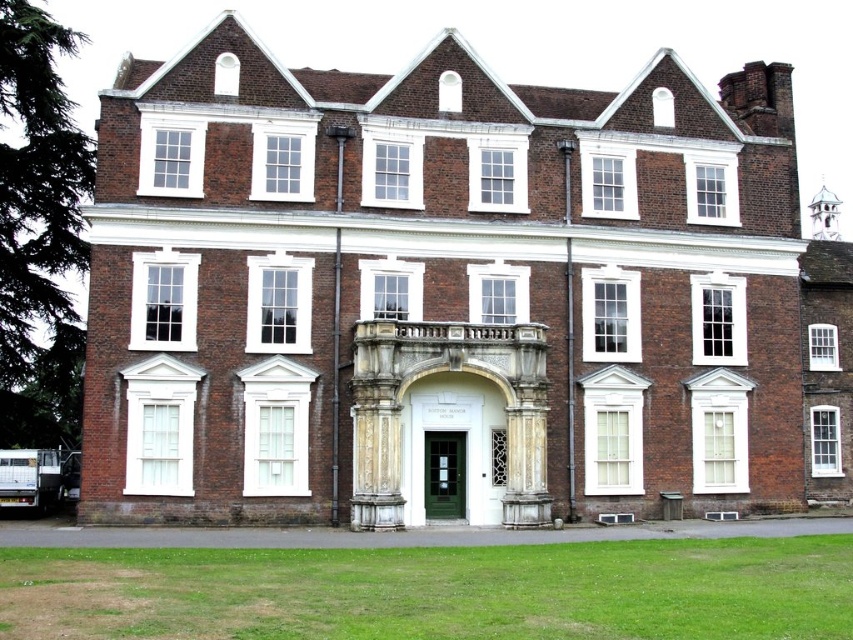
Can you confirm if brown brick mansion at center is wider than green grass at lower center?

Yes, brown brick mansion at center is wider than green grass at lower center.

Is brown brick mansion at center above green grass at lower center?

Correct, brown brick mansion at center is located above green grass at lower center.

Who is more forward, (496,384) or (720,634)?

Point (720,634) is more forward.

Image resolution: width=853 pixels, height=640 pixels. Find the location of `brown brick mansion at center`. brown brick mansion at center is located at coordinates (451, 296).